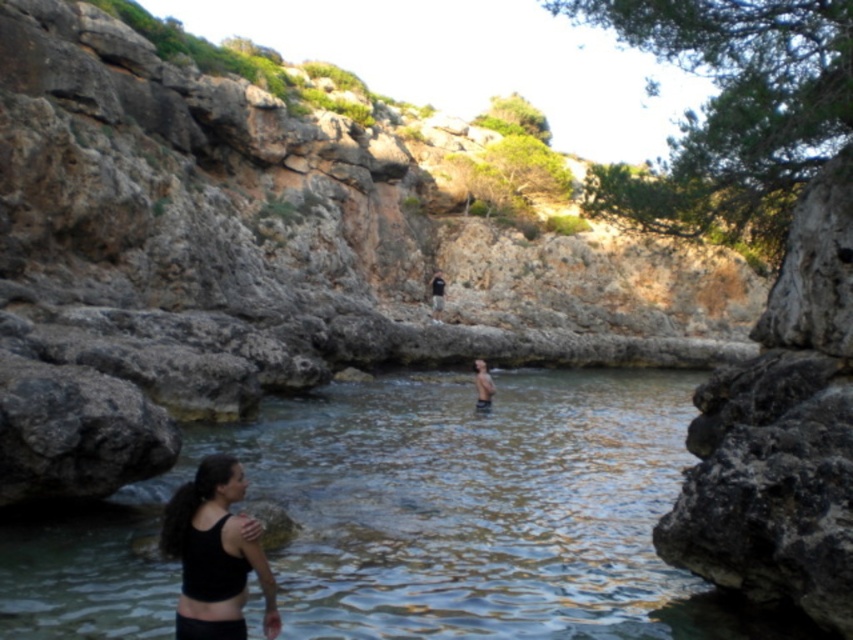
Does rocky cliff at center have a smaller size compared to skinny man at center?

No.

Who is positioned more to the right, rocky cliff at center or skinny man at center?

skinny man at center

You are a GUI agent. You are given a task and a screenshot of the screen. Output one action in this format:
    pyautogui.click(x=<x>, y=<y>)
    Task: Click on the rocky cliff at center
    
    Given the screenshot: What is the action you would take?
    pyautogui.click(x=276, y=256)

The image size is (853, 640). I want to click on rocky cliff at center, so click(276, 256).

Measure the distance between black matte tank top at lower left and camera.

A distance of 21.53 meters exists between black matte tank top at lower left and camera.

Can you confirm if black matte tank top at lower left is positioned to the right of skinny man at center?

In fact, black matte tank top at lower left is to the left of skinny man at center.

Image resolution: width=853 pixels, height=640 pixels. Describe the element at coordinates (213, 554) in the screenshot. I see `black matte tank top at lower left` at that location.

Image resolution: width=853 pixels, height=640 pixels. Find the location of `black matte tank top at lower left`. black matte tank top at lower left is located at coordinates (213, 554).

Between clear water at center and skinny man at center, which one appears on the left side from the viewer's perspective?

clear water at center

Can you confirm if clear water at center is bigger than skinny man at center?

Correct, clear water at center is larger in size than skinny man at center.

Image resolution: width=853 pixels, height=640 pixels. Describe the element at coordinates (469, 506) in the screenshot. I see `clear water at center` at that location.

At what (x,y) coordinates should I click in order to perform the action: click on clear water at center. Please return your answer as a coordinate pair (x, y). The image size is (853, 640). Looking at the image, I should click on (469, 506).